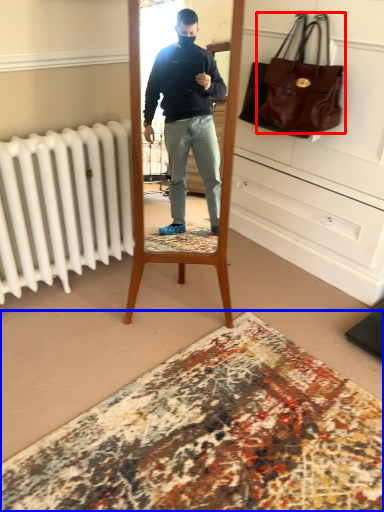
Question: Among these objects, which one is nearest to the camera, handbag (highlighted by a red box) or plain (highlighted by a blue box)?

Choices:
 (A) handbag
 (B) plain

Answer: (B)